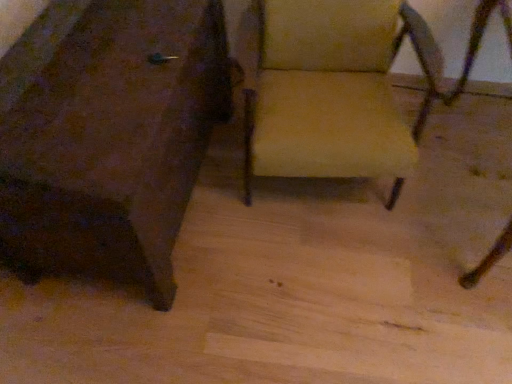
What is the approximate width of beige fabric chair at center, which is the second chair in left-to-right order?

It is 27.38 inches.

How much space does beige fabric chair at center, which is counted as the first chair, starting from the right, occupy vertically?

It is 32.61 inches.

Describe the element at coordinates (333, 91) in the screenshot. I see `beige fabric chair at center, which is counted as the first chair, starting from the right` at that location.

Identify the location of beige fabric chair at center, which is the second chair in left-to-right order. This screenshot has height=384, width=512. (333, 91).

Measure the distance between point (292, 72) and camera.

Point (292, 72) is 1.58 meters from camera.

The width and height of the screenshot is (512, 384). Identify the location of matte brown chair at center, the 1th chair in the left-to-right sequence. (109, 134).

This screenshot has height=384, width=512. What do you see at coordinates (109, 134) in the screenshot?
I see `matte brown chair at center, which ranks as the 2th chair in right-to-left order` at bounding box center [109, 134].

Image resolution: width=512 pixels, height=384 pixels. Find the location of `beige fabric chair at center, which is counted as the first chair, starting from the right`. beige fabric chair at center, which is counted as the first chair, starting from the right is located at coordinates (333, 91).

Considering the relative positions of matte brown chair at center, the 1th chair in the left-to-right sequence, and beige fabric chair at center, which is the second chair in left-to-right order, in the image provided, is matte brown chair at center, the 1th chair in the left-to-right sequence, to the left of beige fabric chair at center, which is the second chair in left-to-right order, from the viewer's perspective?

Correct, you'll find matte brown chair at center, the 1th chair in the left-to-right sequence, to the left of beige fabric chair at center, which is the second chair in left-to-right order.

Between matte brown chair at center, the 1th chair in the left-to-right sequence, and beige fabric chair at center, which is counted as the first chair, starting from the right, which one is positioned behind?

beige fabric chair at center, which is counted as the first chair, starting from the right, is more distant.

Considering the positions of point (93, 226) and point (385, 142), is point (93, 226) closer or farther from the camera than point (385, 142)?

Point (93, 226) is closer to the camera than point (385, 142).

Looking at this image, from the image's perspective, would you say matte brown chair at center, which ranks as the 2th chair in right-to-left order, is positioned over beige fabric chair at center, which is the second chair in left-to-right order?

Incorrect, from the image's perspective, matte brown chair at center, which ranks as the 2th chair in right-to-left order, is lower than beige fabric chair at center, which is the second chair in left-to-right order.

From a real-world perspective, is matte brown chair at center, which ranks as the 2th chair in right-to-left order, located beneath beige fabric chair at center, which is the second chair in left-to-right order?

Yes, from a real-world perspective, matte brown chair at center, which ranks as the 2th chair in right-to-left order, is beneath beige fabric chair at center, which is the second chair in left-to-right order.

Considering the sizes of matte brown chair at center, the 1th chair in the left-to-right sequence, and beige fabric chair at center, which is the second chair in left-to-right order, in the image, is matte brown chair at center, the 1th chair in the left-to-right sequence, wider or thinner than beige fabric chair at center, which is the second chair in left-to-right order,?

matte brown chair at center, the 1th chair in the left-to-right sequence, is wider than beige fabric chair at center, which is the second chair in left-to-right order.

From their relative heights in the image, would you say matte brown chair at center, which ranks as the 2th chair in right-to-left order, is taller or shorter than beige fabric chair at center, which is counted as the first chair, starting from the right?

In the image, matte brown chair at center, which ranks as the 2th chair in right-to-left order, appears to be shorter than beige fabric chair at center, which is counted as the first chair, starting from the right.

Consider the image. Between matte brown chair at center, which ranks as the 2th chair in right-to-left order, and beige fabric chair at center, which is the second chair in left-to-right order, which one has smaller size?

Smaller between the two is beige fabric chair at center, which is the second chair in left-to-right order.

Would you say beige fabric chair at center, which is counted as the first chair, starting from the right, is part of matte brown chair at center, which ranks as the 2th chair in right-to-left order,'s contents?

Definitely not — beige fabric chair at center, which is counted as the first chair, starting from the right, is not inside matte brown chair at center, which ranks as the 2th chair in right-to-left order.

Are matte brown chair at center, the 1th chair in the left-to-right sequence, and beige fabric chair at center, which is counted as the first chair, starting from the right, far apart?

No, there isn't a large distance between matte brown chair at center, the 1th chair in the left-to-right sequence, and beige fabric chair at center, which is counted as the first chair, starting from the right.

Is beige fabric chair at center, which is the second chair in left-to-right order, at the back of matte brown chair at center, the 1th chair in the left-to-right sequence?

No, matte brown chair at center, the 1th chair in the left-to-right sequence,'s orientation is not away from beige fabric chair at center, which is the second chair in left-to-right order.

Can you tell me how much matte brown chair at center, the 1th chair in the left-to-right sequence, and beige fabric chair at center, which is the second chair in left-to-right order, differ in facing direction?

They differ by 3.61 degrees in their facing directions.

Find the location of `chair below the beige fabric chair at center, which is the second chair in left-to-right order (from the image's perspective)`. chair below the beige fabric chair at center, which is the second chair in left-to-right order (from the image's perspective) is located at coordinates (109, 134).

Between beige fabric chair at center, which is the second chair in left-to-right order, and matte brown chair at center, which ranks as the 2th chair in right-to-left order, which one appears on the right side from the viewer's perspective?

Positioned to the right is beige fabric chair at center, which is the second chair in left-to-right order.

Is beige fabric chair at center, which is the second chair in left-to-right order, further to the viewer compared to matte brown chair at center, which ranks as the 2th chair in right-to-left order?

That is True.

Is point (382, 35) closer or farther from the camera than point (143, 221)?

Clearly, point (382, 35) is more distant from the camera than point (143, 221).

From the image's perspective, which one is positioned higher, beige fabric chair at center, which is counted as the first chair, starting from the right, or matte brown chair at center, the 1th chair in the left-to-right sequence?

From the image's view, beige fabric chair at center, which is counted as the first chair, starting from the right, is above.

From a real-world perspective, between beige fabric chair at center, which is counted as the first chair, starting from the right, and matte brown chair at center, which ranks as the 2th chair in right-to-left order, who is vertically higher?

beige fabric chair at center, which is counted as the first chair, starting from the right, from a real-world perspective.

In the scene shown: Considering the relative sizes of beige fabric chair at center, which is counted as the first chair, starting from the right, and matte brown chair at center, the 1th chair in the left-to-right sequence, in the image provided, is beige fabric chair at center, which is counted as the first chair, starting from the right, thinner than matte brown chair at center, the 1th chair in the left-to-right sequence,?

Yes, beige fabric chair at center, which is counted as the first chair, starting from the right, is thinner than matte brown chair at center, the 1th chair in the left-to-right sequence.

Considering the sizes of objects beige fabric chair at center, which is the second chair in left-to-right order, and matte brown chair at center, the 1th chair in the left-to-right sequence, in the image provided, who is shorter, beige fabric chair at center, which is the second chair in left-to-right order, or matte brown chair at center, the 1th chair in the left-to-right sequence,?

matte brown chair at center, the 1th chair in the left-to-right sequence.

Can you confirm if beige fabric chair at center, which is counted as the first chair, starting from the right, is bigger than matte brown chair at center, the 1th chair in the left-to-right sequence?

Actually, beige fabric chair at center, which is counted as the first chair, starting from the right, might be smaller than matte brown chair at center, the 1th chair in the left-to-right sequence.

Is beige fabric chair at center, which is counted as the first chair, starting from the right, located outside matte brown chair at center, which ranks as the 2th chair in right-to-left order?

beige fabric chair at center, which is counted as the first chair, starting from the right, lies outside matte brown chair at center, which ranks as the 2th chair in right-to-left order,'s area.

Is beige fabric chair at center, which is the second chair in left-to-right order, directly adjacent to matte brown chair at center, the 1th chair in the left-to-right sequence?

No, beige fabric chair at center, which is the second chair in left-to-right order, is not touching matte brown chair at center, the 1th chair in the left-to-right sequence.

Consider the image. Is matte brown chair at center, which ranks as the 2th chair in right-to-left order, at the back of beige fabric chair at center, which is counted as the first chair, starting from the right?

No, matte brown chair at center, which ranks as the 2th chair in right-to-left order, is not at the back of beige fabric chair at center, which is counted as the first chair, starting from the right.

How many degrees apart are the facing directions of beige fabric chair at center, which is the second chair in left-to-right order, and matte brown chair at center, which ranks as the 2th chair in right-to-left order?

They differ by 3.61 degrees in their facing directions.

How distant is beige fabric chair at center, which is the second chair in left-to-right order, from matte brown chair at center, which ranks as the 2th chair in right-to-left order?

They are 17.51 inches apart.

Find the location of `chair in front of the beige fabric chair at center, which is the second chair in left-to-right order`. chair in front of the beige fabric chair at center, which is the second chair in left-to-right order is located at coordinates (109, 134).

This screenshot has height=384, width=512. In order to click on chair that is on the left side of beige fabric chair at center, which is the second chair in left-to-right order in this screenshot , I will do click(109, 134).

Locate an element on the screen. The height and width of the screenshot is (384, 512). chair behind the matte brown chair at center, the 1th chair in the left-to-right sequence is located at coordinates (333, 91).